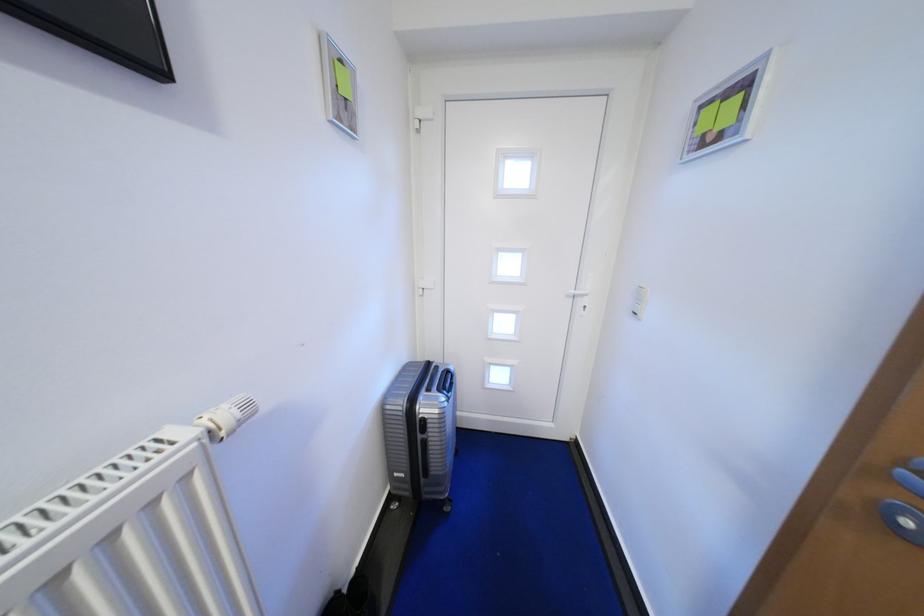
Where would you pull the white door handle? Please return your answer as a coordinate pair (x, y).

(579, 292)